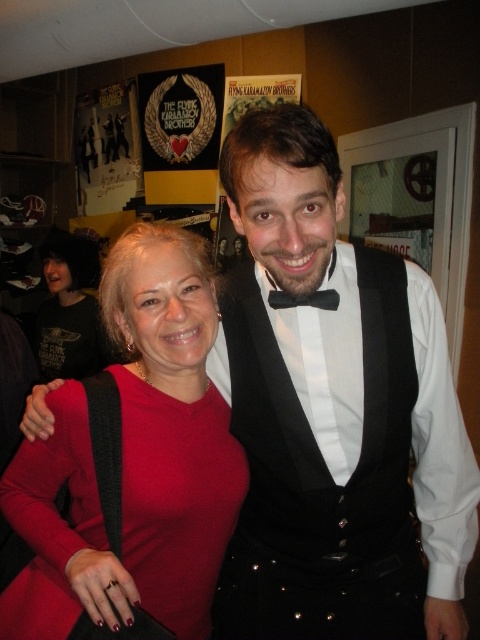
Question: Can you confirm if matte red sweater at center is positioned below black satin bow tie at center?

Choices:
 (A) yes
 (B) no

Answer: (A)

Question: Which of the following is the farthest from the observer?

Choices:
 (A) (276, 300)
 (B) (29, 612)

Answer: (B)

Question: Which point is closer to the camera taking this photo?

Choices:
 (A) (235, 456)
 (B) (321, 304)

Answer: (B)

Question: In this image, where is matte red sweater at center located relative to black satin bow tie at center?

Choices:
 (A) above
 (B) below

Answer: (B)

Question: Can you confirm if matte red sweater at center is positioned above black satin bow tie at center?

Choices:
 (A) yes
 (B) no

Answer: (B)